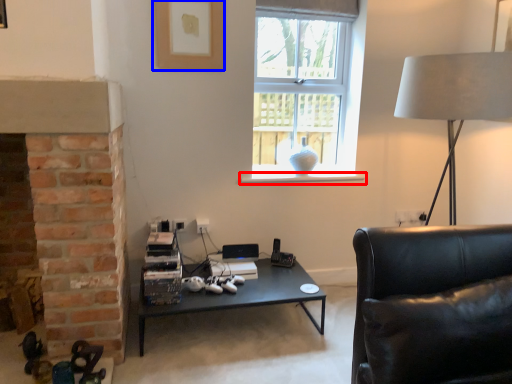
Question: Which point is further to the camera, window sill (highlighted by a red box) or picture frame (highlighted by a blue box)?

Choices:
 (A) window sill
 (B) picture frame

Answer: (A)